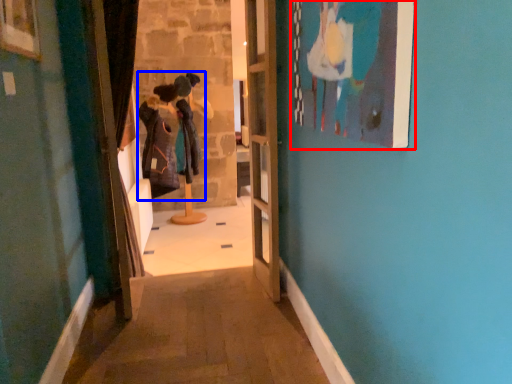
Question: Which point is closer to the camera, picture frame (highlighted by a red box) or couple (highlighted by a blue box)?

Choices:
 (A) picture frame
 (B) couple

Answer: (A)